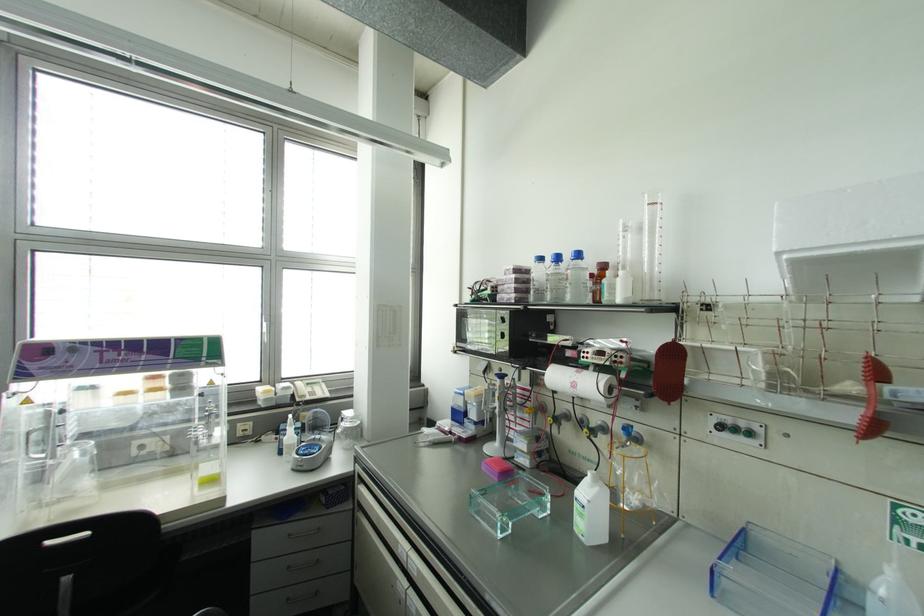
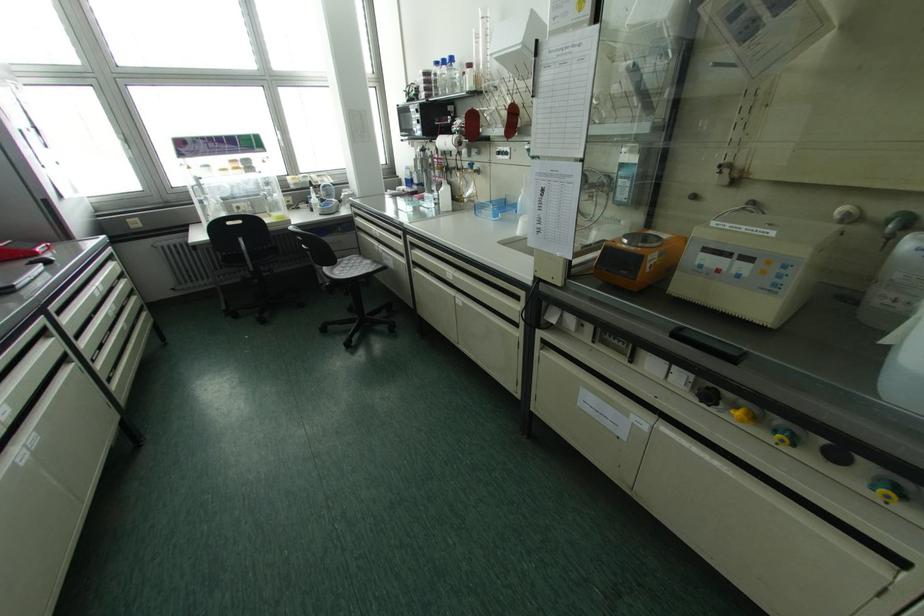
The point at (608,491) is marked in the first image. Where is the corresponding point in the second image?

(448, 187)